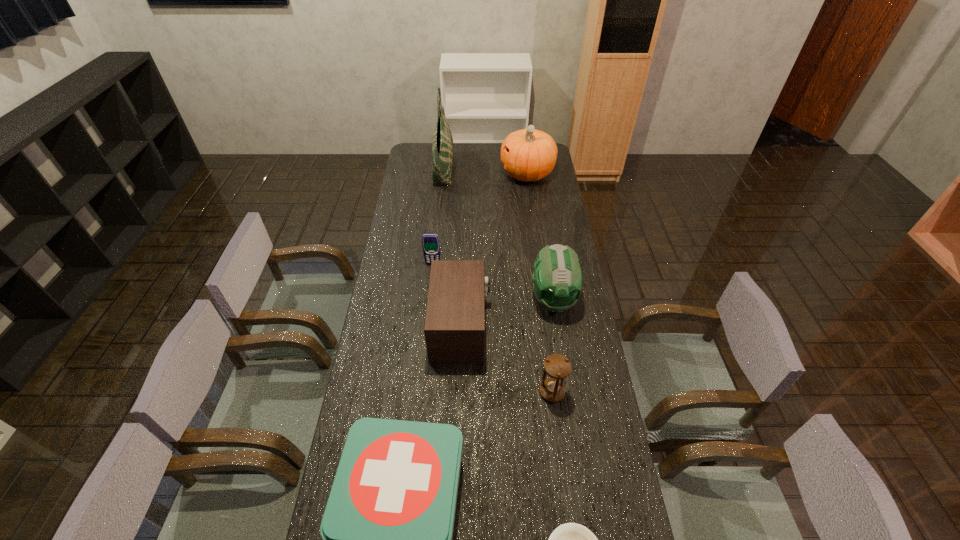
This screenshot has height=540, width=960. In order to click on hourglass located in the right edge section of the desktop in this screenshot , I will do `click(557, 366)`.

Find the location of a particular element. The image size is (960, 540). object positioned at the far left corner is located at coordinates (442, 143).

Find the location of a particular element. The image size is (960, 540). object that is at the far right corner is located at coordinates (528, 155).

Locate an element on the screen. vacant space at the left edge is located at coordinates (376, 339).

Identify the location of free point at the right edge. (592, 422).

Identify the location of blank region between the radio receiver and the sixth farthest object. This screenshot has width=960, height=540. pos(507,360).

What are the coordinates of `unoccupied position between the radio receiver and the football helmet` in the screenshot? It's located at (507, 313).

I want to click on unoccupied position between the tallest object and the hourglass, so click(x=497, y=280).

Identify the location of the fourth closest object to the radio receiver. (387, 529).

Identify which object is the fourth nearest to the bowl. Please provide its 2D coordinates. Your answer should be formatted as a tuple, i.e. [(x, y)], where the tuple contains the x and y coordinates of a point satisfying the conditions above.

[(557, 279)]